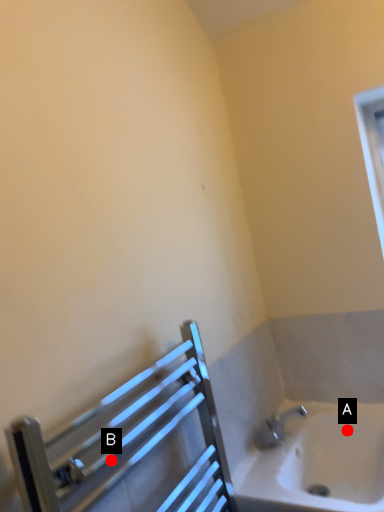
Question: Two points are circled on the image, labeled by A and B beside each circle. Among these points, which one is nearest to the camera?

Choices:
 (A) A is closer
 (B) B is closer

Answer: (B)